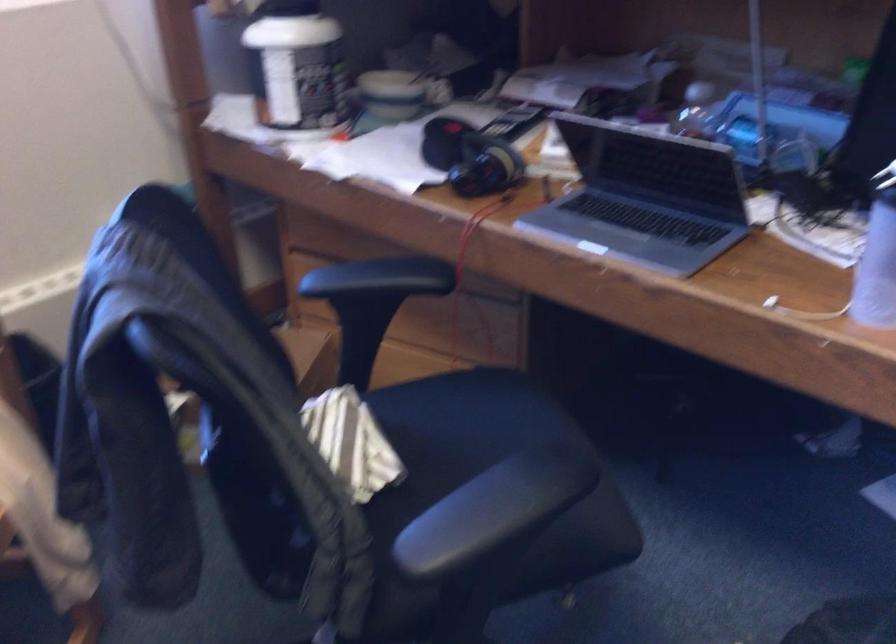
Find the location of `clear plastic cup`. clear plastic cup is located at coordinates (876, 268).